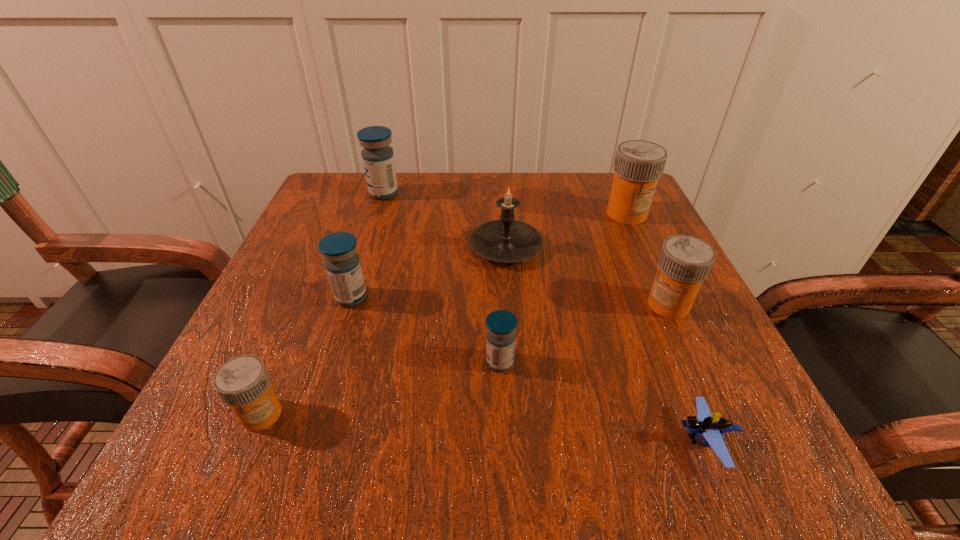
You are a GUI agent. You are given a task and a screenshot of the screen. Output one action in this format:
    pyautogui.click(x=<x>, y=<y>)
    Task: Click on the medicine that stands as the second closest to the second farthest orange medicine
    
    Given the screenshot: What is the action you would take?
    pyautogui.click(x=501, y=325)

Locate an element on the screen. The width and height of the screenshot is (960, 540). medicine object that ranks as the fourth closest to the second nearest orange medicine is located at coordinates (378, 160).

You are a GUI agent. You are given a task and a screenshot of the screen. Output one action in this format:
    pyautogui.click(x=<x>, y=<y>)
    Task: Click on the blue medicine identified as the closest to the second farthest blue medicine
    
    Given the screenshot: What is the action you would take?
    pyautogui.click(x=501, y=325)

This screenshot has height=540, width=960. I want to click on blue medicine that stands as the second closest to the blue Lego, so click(x=342, y=263).

Locate an element on the screen. Image resolution: width=960 pixels, height=540 pixels. orange medicine object that ranks as the closest to the fourth medicine from left to right is located at coordinates (685, 261).

Identify the location of orange medicine that stands as the closest to the candle. Image resolution: width=960 pixels, height=540 pixels. pos(638,165).

Where is `blank area in the image that satisfies the following two spatial constraints: 1. on the label side of the second nearest orange medicine; 2. on the label side of the leftmost medicine`? The image size is (960, 540). blank area in the image that satisfies the following two spatial constraints: 1. on the label side of the second nearest orange medicine; 2. on the label side of the leftmost medicine is located at coordinates (719, 414).